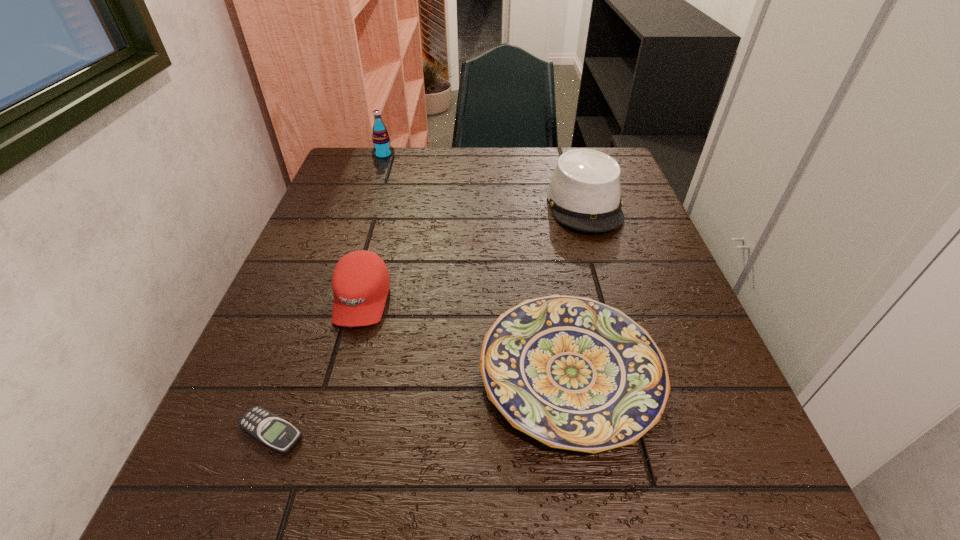
Locate an element on the screen. Image resolution: width=960 pixels, height=540 pixels. vacant point located between the cap and the plate is located at coordinates (466, 336).

The image size is (960, 540). Identify the location of vacant region between the plate and the shortest object. (420, 403).

Locate an element on the screen. The height and width of the screenshot is (540, 960). vacant region between the hat and the beeper is located at coordinates (428, 318).

This screenshot has width=960, height=540. In order to click on free space between the farthest object and the cap in this screenshot , I will do `click(372, 228)`.

The width and height of the screenshot is (960, 540). Find the location of `free space between the tallest object and the plate`. free space between the tallest object and the plate is located at coordinates (477, 264).

Locate an element on the screen. The height and width of the screenshot is (540, 960). object that stands as the second closest to the fourth shortest object is located at coordinates (360, 282).

Locate which object ranks second in proximity to the hat. Please provide its 2D coordinates. Your answer should be formatted as a tuple, i.e. [(x, y)], where the tuple contains the x and y coordinates of a point satisfying the conditions above.

[(360, 282)]

Identify the location of vacant space that satisfies the following two spatial constraints: 1. on the front-facing side of the cap; 2. on the left side of the fourth tallest object. This screenshot has height=540, width=960. (342, 373).

This screenshot has height=540, width=960. I want to click on free point that satisfies the following two spatial constraints: 1. on the front-facing side of the plate; 2. on the right side of the third tallest object, so click(342, 373).

Identify the location of vacant region that satisfies the following two spatial constraints: 1. on the front side of the second shortest object; 2. on the right side of the soda. (311, 373).